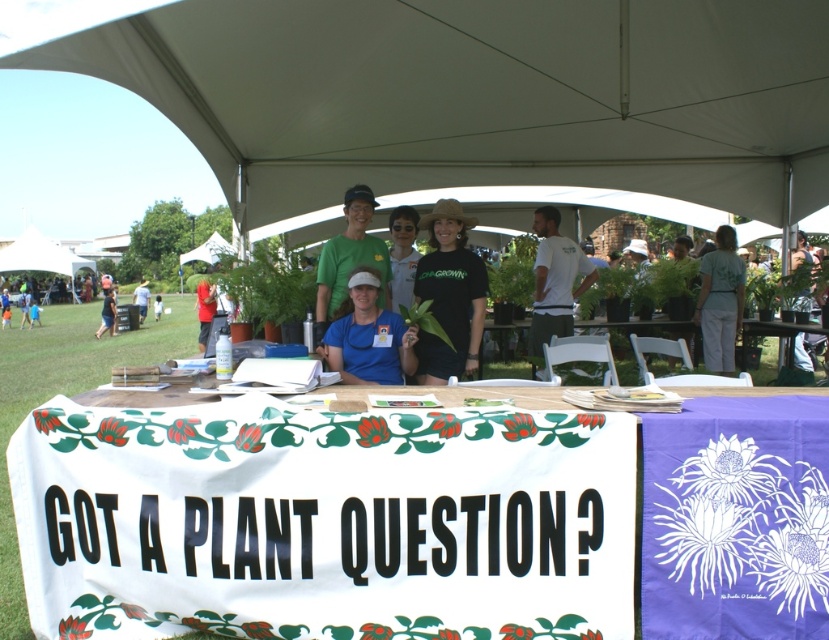
You are at the outdoor event and want to locate the information about plant care. The white fabric at center and blue fabric sign at center are both on the table. Which one is positioned lower on the table?

The white fabric at center is below the blue fabric sign at center, so the white fabric at center is positioned lower on the table.